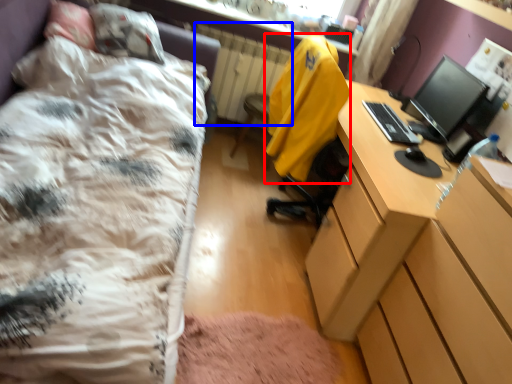
Question: Which object appears farthest to the camera in this image, jacket (highlighted by a red box) or radiator (highlighted by a blue box)?

Choices:
 (A) jacket
 (B) radiator

Answer: (B)